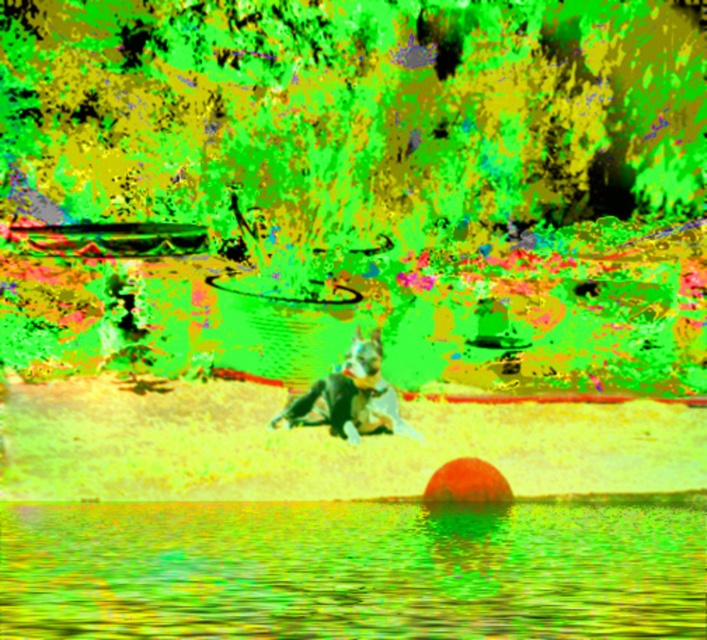
Consider the image. You are standing at the edge of the water and want to walk to the two points marked in the scene. Which point, point (x=356, y=579) or point (x=366, y=392), is closer to you?

Point (x=356, y=579) is closer to the viewer than point (x=366, y=392), so you would reach point (x=356, y=579) first.

You are a photographer trying to capture the scene. You want to ensure the smooth water at lower center and the black matte dog at center are both in frame. Which object should you adjust your camera to focus on first if you want to capture the wider subject first?

The smooth water at lower center should be focused on first because its width surpasses that of the black matte dog at center, making it the wider subject.

You are standing at the edge of the scene and want to walk towards the black matte dog at center. Which direction should you move relative to the smooth water at lower center?

You should move to the right of the smooth water at lower center to reach the black matte dog at center because the smooth water at lower center is located to the left of the black matte dog at center.